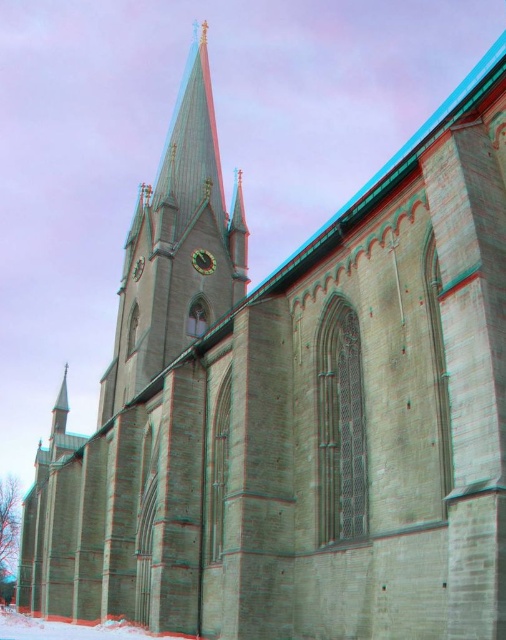
You are standing in front of the Gothic church and want to take a photo of both the green stone steeple at upper center and the metallic clock at center. Which one should you focus on first to ensure both are in sharp focus?

You should focus on the green stone steeple at upper center first because it is closer to the viewer than the metallic clock at center, so adjusting focus from near to far will help both be in focus.

You are an architect analyzing the Gothic church. You need to locate the green stone steeple at upper center. What are its coordinates in the image?

The green stone steeple at upper center is located at coordinates point (177, 248).

You are standing in front of the Gothic church and want to locate the metallic clock at center. Which direction should you look relative to the green stone steeple at upper center?

The green stone steeple at upper center is positioned over the metallic clock at center, so you should look downward from the green stone steeple at upper center to find the metallic clock at center.